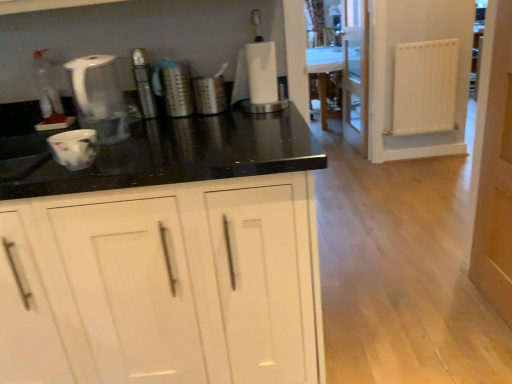
Question: Is point (119, 119) positioned closer to the camera than point (218, 86)?

Choices:
 (A) closer
 (B) farther

Answer: (A)

Question: From a real-world perspective, is white plastic kettle at upper left above or below brushed metal canister at center, marked as the 3th appliance in a left-to-right arrangement?

Choices:
 (A) below
 (B) above

Answer: (B)

Question: Based on their relative distances, which object is farther from the brushed metal canister at center, marked as the 3th appliance in a left-to-right arrangement?

Choices:
 (A) transparent glass screen door at center
 (B) white paper towel holder at center, positioned as the 4th appliance in left-to-right order
 (C) white matte radiator at right
 (D) wooden door at right
 (E) metallic cylindrical at center, which ranks as the first appliance in left-to-right order

Answer: (A)

Question: Which of these objects is positioned closest to the wooden door at right?

Choices:
 (A) white paper towel holder at center, which is the 1th appliance in right-to-left order
 (B) transparent glass screen door at center
 (C) brushed metal canister at center, marked as the 3th appliance in a left-to-right arrangement
 (D) white matte radiator at right
 (E) white plastic kettle at upper left

Answer: (A)